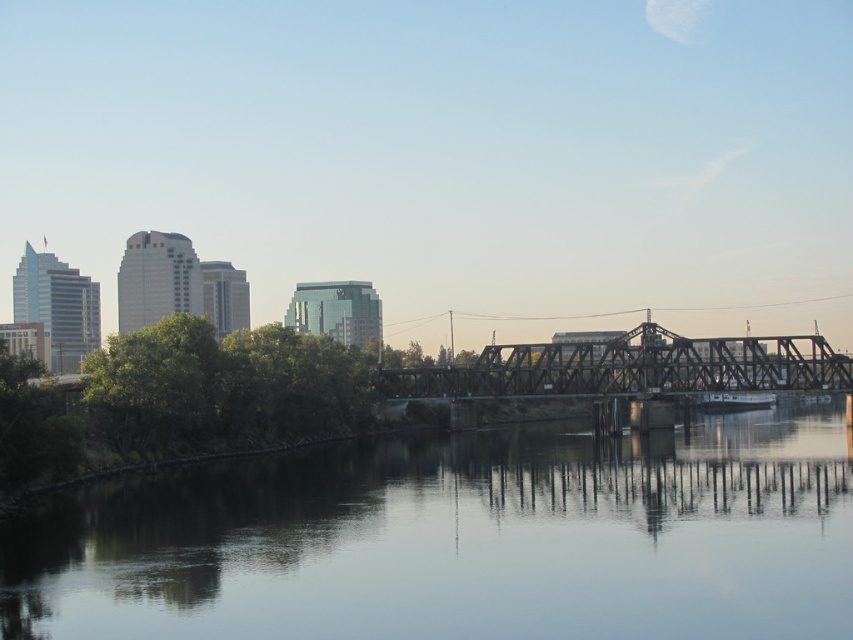
You are a drone operator trying to capture aerial shots of the urban riverside scene. You have two points marked on your map, point A at coordinates point (231, 547) and point B at coordinates point (693, 358). Which point is closer to your current position as the drone operator?

Point point (231, 547) is closer to the viewer than point point (693, 358), so point A is closer to your current position.